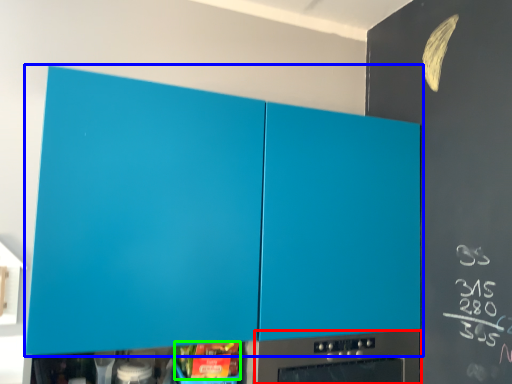
Question: Which is nearer to the home appliance (highlighted by a red box)? cabinetry (highlighted by a blue box) or food (highlighted by a green box).

Choices:
 (A) cabinetry
 (B) food

Answer: (B)